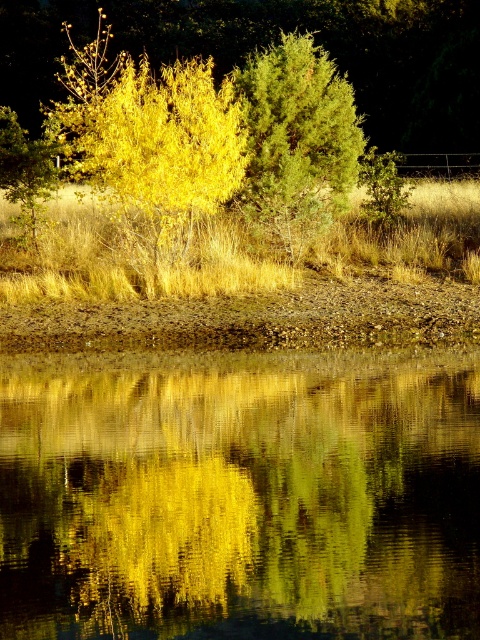
You are standing at the edge of the scene and want to walk towards the green textured tree at center. Which direction should you move to avoid stepping on the green reflective water at center?

You should move to the side away from the green reflective water at center because it is in front of the green textured tree at center, so moving sideways around it would allow you to reach the tree without stepping on the water.

You are a bird flying over the serene natural scene. You see the golden leafy tree at center and the green textured tree at center. Which tree is closer to the ground?

The golden leafy tree at center is positioned under the green textured tree at center, so it is closer to the ground.